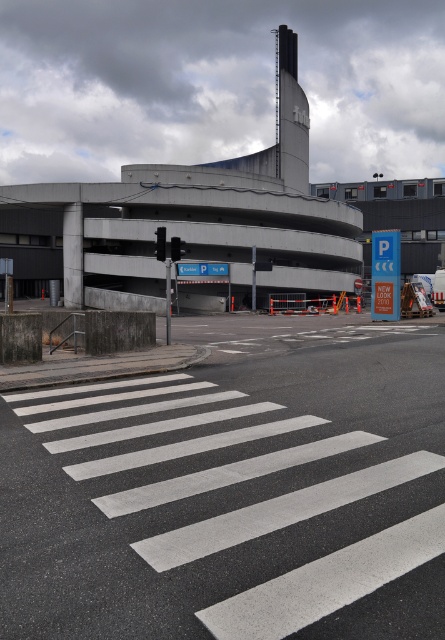
You are driving a car and see the white asphalt crosswalk at center and the black glass traffic light at center ahead. Which object is closer to the ground?

The white asphalt crosswalk at center is located below the black glass traffic light at center, so the white asphalt crosswalk at center is closer to the ground.

You are a pedestrian standing on the sidewalk to the left of the image. You want to cross the street using the white asphalt crosswalk at center. However, there is a red glass traffic light at center in your path. Can you safely cross the street without going around the traffic light?

The white asphalt crosswalk at center is below the red glass traffic light at center, so the traffic light is positioned above the crosswalk. This means you can safely cross the street through the white asphalt crosswalk at center without needing to go around the red glass traffic light at center since it is elevated.